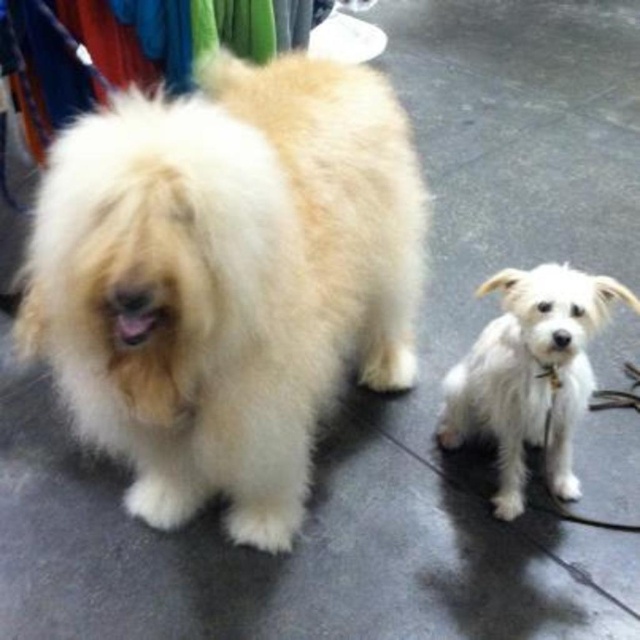
Question: Which object is farther from the camera taking this photo?

Choices:
 (A) fluffy white fur dog at center
 (B) white fluffy dog at lower right

Answer: (B)

Question: Is fluffy white fur dog at center below white fluffy dog at lower right?

Choices:
 (A) no
 (B) yes

Answer: (A)

Question: Is fluffy white fur dog at center positioned behind white fluffy dog at lower right?

Choices:
 (A) yes
 (B) no

Answer: (B)

Question: Which point appears closest to the camera in this image?

Choices:
 (A) (477, 349)
 (B) (250, 378)

Answer: (B)

Question: Is fluffy white fur dog at center behind white fluffy dog at lower right?

Choices:
 (A) yes
 (B) no

Answer: (B)

Question: Which point is farther from the camera taking this photo?

Choices:
 (A) (330, 122)
 (B) (532, 440)

Answer: (B)